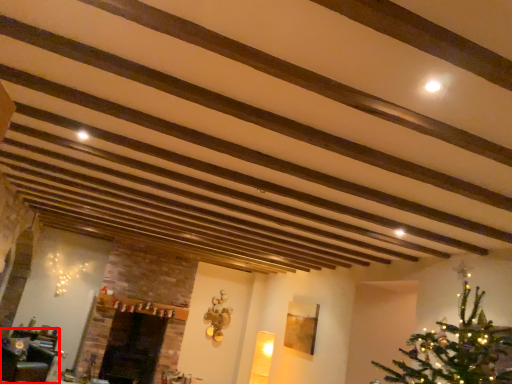
Question: From the image's perspective, where is furniture (annotated by the red box) located in relation to fireplace in the image?

Choices:
 (A) above
 (B) below

Answer: (A)